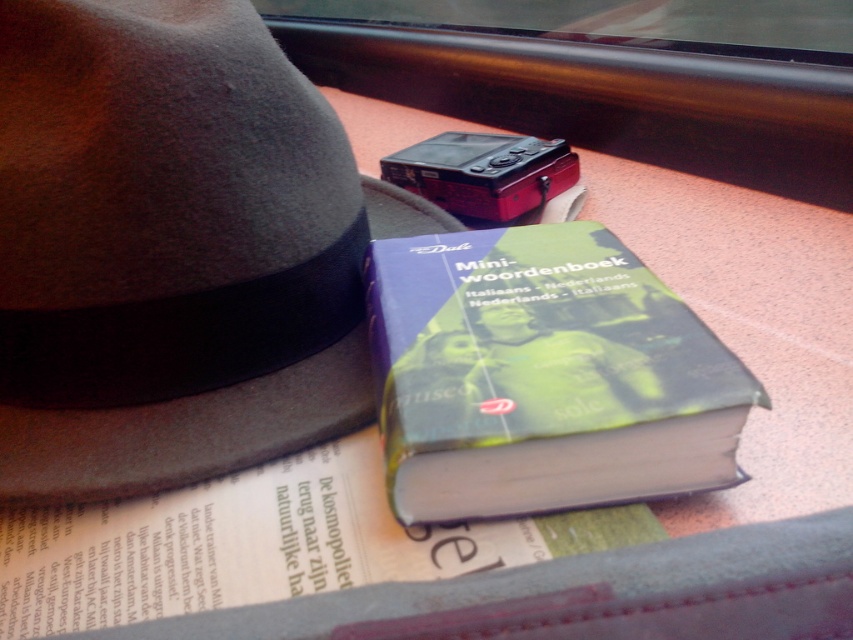
Question: Which object is closer to the camera taking this photo?

Choices:
 (A) gray felt fedora at upper left
 (B) hardcover book at center

Answer: (B)

Question: Does gray felt fedora at upper left have a larger size compared to hardcover book at center?

Choices:
 (A) no
 (B) yes

Answer: (B)

Question: Among these objects, which one is farthest from the camera?

Choices:
 (A) gray felt fedora at upper left
 (B) hardcover book at center

Answer: (A)

Question: Which point appears farthest from the camera in this image?

Choices:
 (A) (572, 276)
 (B) (247, 100)

Answer: (A)

Question: In this image, where is gray felt fedora at upper left located relative to hardcover book at center?

Choices:
 (A) left
 (B) right

Answer: (A)

Question: Can you confirm if gray felt fedora at upper left is smaller than hardcover book at center?

Choices:
 (A) yes
 (B) no

Answer: (B)